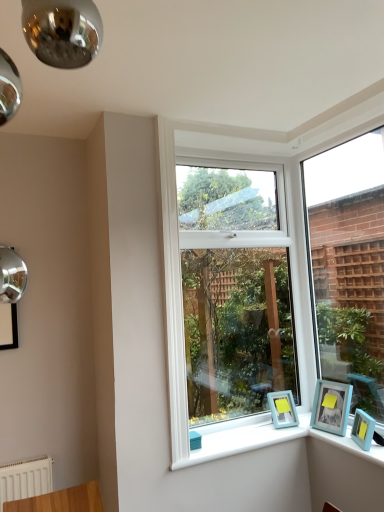
Locate an element on the screen. The width and height of the screenshot is (384, 512). free space above white plastic window at center, arranged as the 1th window when viewed from the left (from a real-world perspective) is located at coordinates (231, 143).